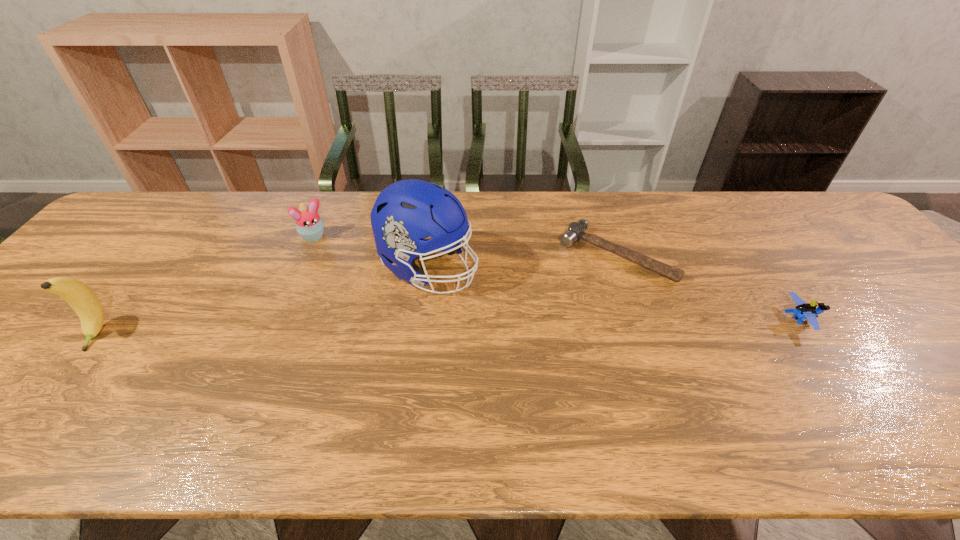
At what (x,y) coordinates should I click in order to perform the action: click on vacant spot on the desktop that is between the banana and the Lego and is positioned on the face guard of the third object from right to left. Please return your answer as a coordinate pair (x, y). The height and width of the screenshot is (540, 960). Looking at the image, I should click on (545, 325).

The image size is (960, 540). Identify the location of free spot on the desktop that is between the banana and the Lego and is positioned on the striking face of the hammer. (558, 325).

Identify the location of free space on the desktop that is between the leftmost object and the Lego and is positioned on the face of the fourth object from right to left. This screenshot has width=960, height=540. (372, 328).